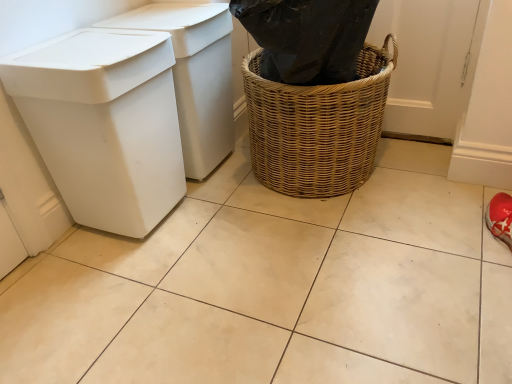
Question: From the image's perspective, is woven brown basket at center located beneath white plastic bin at left, the first waste container in the back-to-front sequence?

Choices:
 (A) yes
 (B) no

Answer: (A)

Question: From the image's perspective, is woven brown basket at center on top of white plastic bin at left, the first waste container in the back-to-front sequence?

Choices:
 (A) no
 (B) yes

Answer: (A)

Question: Can you confirm if woven brown basket at center is positioned to the left of white plastic bin at left, the first waste container in the back-to-front sequence?

Choices:
 (A) yes
 (B) no

Answer: (B)

Question: Can you confirm if woven brown basket at center is smaller than white plastic bin at left, the first waste container in the back-to-front sequence?

Choices:
 (A) yes
 (B) no

Answer: (B)

Question: Is woven brown basket at center positioned before white plastic bin at left, the first waste container in the back-to-front sequence?

Choices:
 (A) no
 (B) yes

Answer: (B)

Question: Does woven brown basket at center have a greater width compared to white plastic bin at left, acting as the second waste container starting from the front?

Choices:
 (A) no
 (B) yes

Answer: (B)

Question: Does white plastic bin at left, the first waste container in the back-to-front sequence, appear on the left side of white plastic bin at left, the 1th waste container viewed from the front?

Choices:
 (A) yes
 (B) no

Answer: (B)

Question: From a real-world perspective, is white plastic bin at left, acting as the second waste container starting from the front, on top of white plastic bin at left, the 1th waste container viewed from the front?

Choices:
 (A) yes
 (B) no

Answer: (B)

Question: Considering the relative sizes of white plastic bin at left, acting as the second waste container starting from the front, and white plastic bin at left, which is the 2th waste container in back-to-front order, in the image provided, is white plastic bin at left, acting as the second waste container starting from the front, thinner than white plastic bin at left, which is the 2th waste container in back-to-front order,?

Choices:
 (A) no
 (B) yes

Answer: (B)

Question: From the image's perspective, is white plastic bin at left, the first waste container in the back-to-front sequence, under white plastic bin at left, which is the 2th waste container in back-to-front order?

Choices:
 (A) yes
 (B) no

Answer: (B)

Question: From a real-world perspective, does white plastic bin at left, the first waste container in the back-to-front sequence, sit lower than white plastic bin at left, which is the 2th waste container in back-to-front order?

Choices:
 (A) no
 (B) yes

Answer: (B)

Question: Does white plastic bin at left, the first waste container in the back-to-front sequence, have a greater width compared to white plastic bin at left, the 1th waste container viewed from the front?

Choices:
 (A) no
 (B) yes

Answer: (A)

Question: Would you consider white plastic bin at left, the first waste container in the back-to-front sequence, to be distant from woven brown basket at center?

Choices:
 (A) yes
 (B) no

Answer: (B)